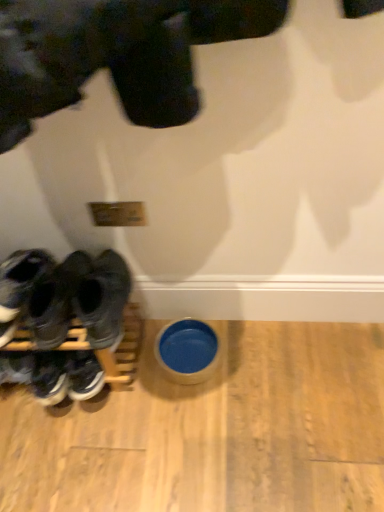
Question: From the image's perspective, is blue ceramic bowl at lower center located beneath black rubber shoes at left, which is the 1th footwear in right-to-left order?

Choices:
 (A) no
 (B) yes

Answer: (B)

Question: Is blue ceramic bowl at lower center wider than black rubber shoes at left, the 3th footwear viewed from the left?

Choices:
 (A) yes
 (B) no

Answer: (B)

Question: Is blue ceramic bowl at lower center closer to camera compared to black rubber shoes at left, the 3th footwear viewed from the left?

Choices:
 (A) yes
 (B) no

Answer: (B)

Question: From a real-world perspective, is blue ceramic bowl at lower center located higher than black rubber shoes at left, the 3th footwear viewed from the left?

Choices:
 (A) yes
 (B) no

Answer: (B)

Question: From a real-world perspective, is blue ceramic bowl at lower center under black rubber shoes at left, the 3th footwear viewed from the left?

Choices:
 (A) yes
 (B) no

Answer: (A)

Question: Is blue ceramic bowl at lower center smaller than black rubber shoes at left, which is the 1th footwear in right-to-left order?

Choices:
 (A) no
 (B) yes

Answer: (B)

Question: Can dark gray suede sneakers at left, the second footwear viewed from the right, be found inside black leather sneakers at left, which is the third footwear from right to left?

Choices:
 (A) no
 (B) yes

Answer: (A)

Question: Considering the relative sizes of black leather sneakers at left, which is counted as the 1th footwear, starting from the left, and dark gray suede sneakers at left, the second footwear from the left, in the image provided, is black leather sneakers at left, which is counted as the 1th footwear, starting from the left, smaller than dark gray suede sneakers at left, the second footwear from the left,?

Choices:
 (A) yes
 (B) no

Answer: (B)

Question: Is black leather sneakers at left, which is counted as the 1th footwear, starting from the left, with dark gray suede sneakers at left, the second footwear from the left?

Choices:
 (A) yes
 (B) no

Answer: (A)

Question: Could you tell me if black leather sneakers at left, which is the third footwear from right to left, is facing dark gray suede sneakers at left, the second footwear viewed from the right?

Choices:
 (A) no
 (B) yes

Answer: (A)

Question: Would you consider black leather sneakers at left, which is the third footwear from right to left, to be distant from dark gray suede sneakers at left, the second footwear from the left?

Choices:
 (A) yes
 (B) no

Answer: (B)

Question: Can you confirm if black leather sneakers at left, which is counted as the 1th footwear, starting from the left, is thinner than dark gray suede sneakers at left, the second footwear from the left?

Choices:
 (A) yes
 (B) no

Answer: (A)

Question: From a real-world perspective, is dark gray suede sneakers at left, the second footwear viewed from the right, below black leather sneakers at left, which is counted as the 1th footwear, starting from the left?

Choices:
 (A) no
 (B) yes

Answer: (A)